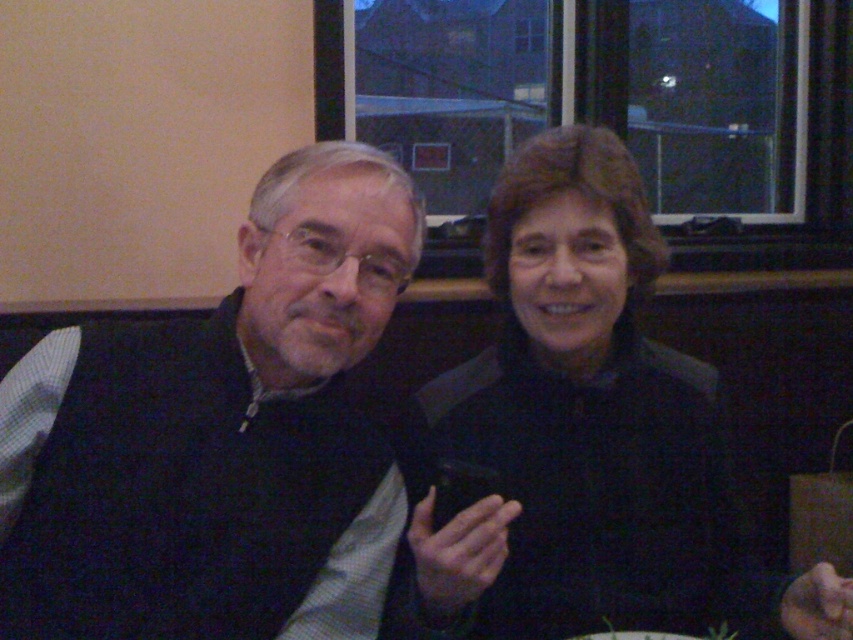
You are a photographer adjusting your camera settings to focus on the dark blue sweater at left. What are the coordinates you should input into your camera to ensure precise focus?

The coordinates for the dark blue sweater at left are at point [218,436], so input those into your camera to focus precisely on it.

In the scene shown: You are a photographer setting up for a group photo. You have two items to place between the dark blue sweater at left and the black matte jacket at center. The items are 10 cm and 15 cm wide respectively. Can both items fit between them without overlapping?

The distance between the dark blue sweater at left and the black matte jacket at center is 25.09 centimeters. The total width of the items is 25 cm. Since 25 cm is less than 25.09 cm, both items can fit between them without overlapping.

You are a photographer who wants to adjust the lighting in the image to ensure both the older man with short gray hair and the woman with shoulder length brown hair are well lit. The dark blue sweater at left is located at point [218,436]. Which object should you focus the lighting on to ensure both subjects are properly illuminated?

The dark blue sweater at left is located at point [218,436], so you should focus the lighting on the dark blue sweater at left to ensure both subjects are properly illuminated.